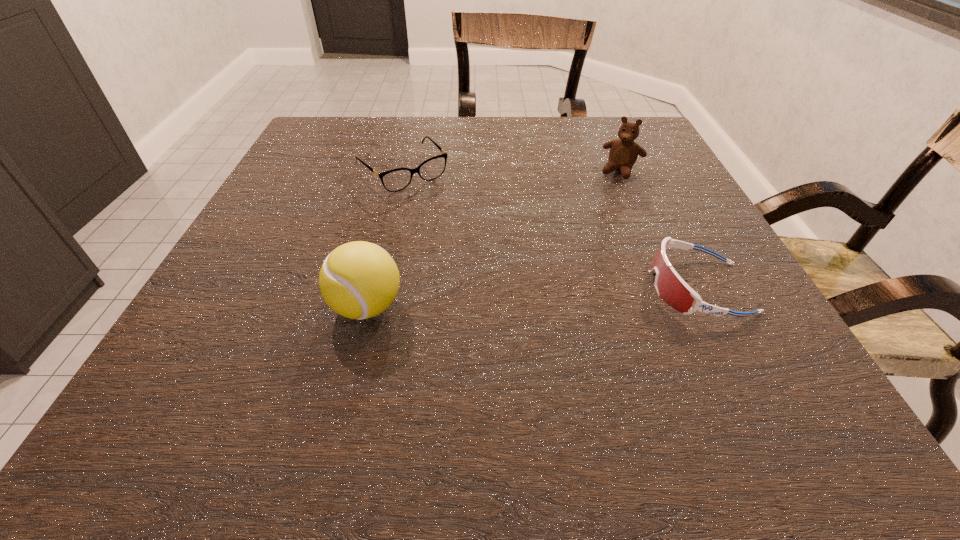
The width and height of the screenshot is (960, 540). Find the location of `vacant area at the far edge of the desktop`. vacant area at the far edge of the desktop is located at coordinates (545, 134).

In the image, there is a desktop. Identify the location of vacant space at the near edge. The width and height of the screenshot is (960, 540). click(x=509, y=348).

Where is `free space at the left edge of the desktop`? This screenshot has width=960, height=540. free space at the left edge of the desktop is located at coordinates (321, 170).

Where is `free space at the right edge of the desktop`? free space at the right edge of the desktop is located at coordinates (689, 241).

In the image, there is a desktop. Find the location of `free space at the far left corner`. free space at the far left corner is located at coordinates (x=303, y=143).

The width and height of the screenshot is (960, 540). I want to click on free space at the near left corner of the desktop, so click(x=216, y=357).

At what (x,y) coordinates should I click in order to perform the action: click on vacant region between the tennis ball and the teddy bear. Please return your answer as a coordinate pair (x, y). The width and height of the screenshot is (960, 540). Looking at the image, I should click on (493, 239).

At what (x,y) coordinates should I click in order to perform the action: click on vacant region between the spectacles and the teddy bear. Please return your answer as a coordinate pair (x, y). Looking at the image, I should click on (512, 171).

The height and width of the screenshot is (540, 960). Find the location of `empty space between the second shortest object and the tennis ball`. empty space between the second shortest object and the tennis ball is located at coordinates (533, 297).

Image resolution: width=960 pixels, height=540 pixels. Find the location of `vacant area that lies between the tennis ball and the spectacles`. vacant area that lies between the tennis ball and the spectacles is located at coordinates coord(385,239).